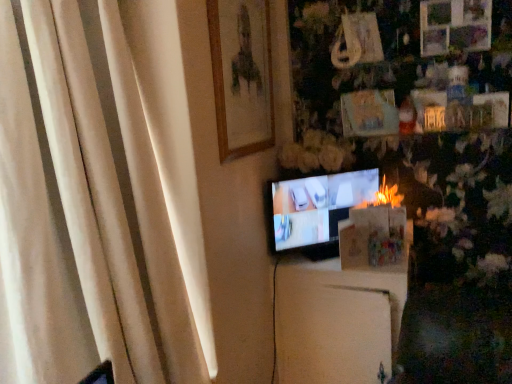
Question: From a real-world perspective, is white fabric curtain at left positioned over matte black tv at center based on gravity?

Choices:
 (A) no
 (B) yes

Answer: (B)

Question: Is white fabric curtain at left in contact with matte black tv at center?

Choices:
 (A) yes
 (B) no

Answer: (B)

Question: From the image's perspective, would you say white fabric curtain at left is shown under matte black tv at center?

Choices:
 (A) yes
 (B) no

Answer: (A)

Question: Is white fabric curtain at left shorter than matte black tv at center?

Choices:
 (A) no
 (B) yes

Answer: (A)

Question: Considering the relative sizes of white fabric curtain at left and matte black tv at center in the image provided, is white fabric curtain at left taller than matte black tv at center?

Choices:
 (A) yes
 (B) no

Answer: (A)

Question: From a real-world perspective, is white fabric curtain at left below matte black tv at center?

Choices:
 (A) yes
 (B) no

Answer: (B)

Question: Is white matte cabinet at center wider than wooden framed portrait at upper center?

Choices:
 (A) no
 (B) yes

Answer: (B)

Question: Is white matte cabinet at center behind wooden framed portrait at upper center?

Choices:
 (A) no
 (B) yes

Answer: (B)

Question: Considering the relative sizes of white matte cabinet at center and wooden framed portrait at upper center in the image provided, is white matte cabinet at center bigger than wooden framed portrait at upper center?

Choices:
 (A) no
 (B) yes

Answer: (B)

Question: Is white matte cabinet at center far from wooden framed portrait at upper center?

Choices:
 (A) yes
 (B) no

Answer: (B)

Question: From a real-world perspective, is white matte cabinet at center below wooden framed portrait at upper center?

Choices:
 (A) no
 (B) yes

Answer: (B)

Question: Considering the relative positions of white matte cabinet at center and wooden framed portrait at upper center in the image provided, is white matte cabinet at center in front of wooden framed portrait at upper center?

Choices:
 (A) no
 (B) yes

Answer: (A)

Question: From the image's perspective, is wooden framed portrait at upper center beneath matte black tv at center?

Choices:
 (A) yes
 (B) no

Answer: (B)